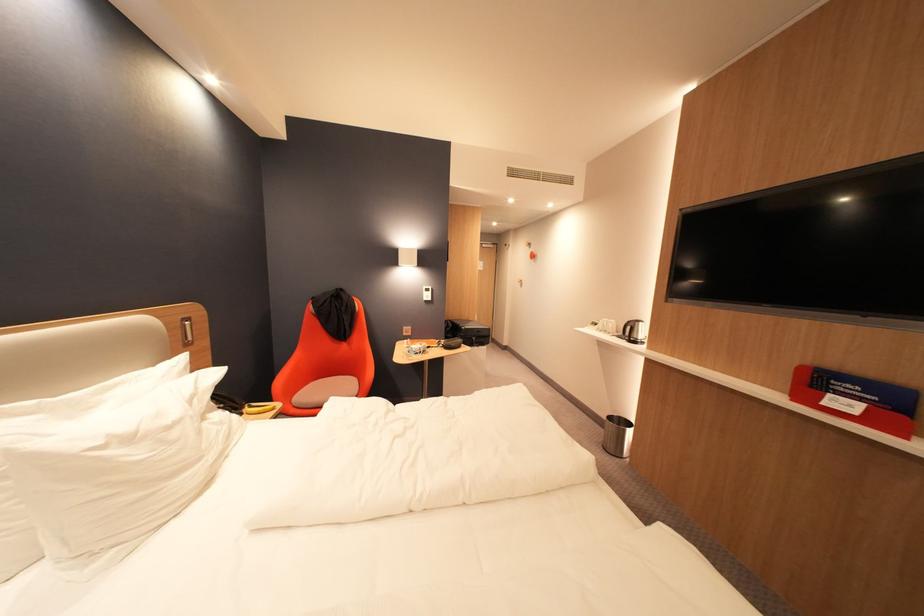
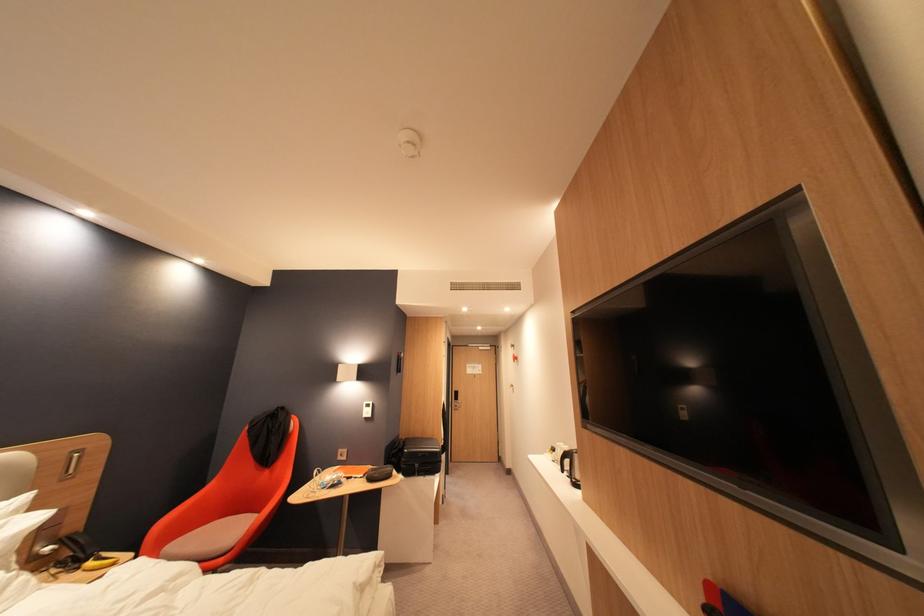
Find the pixel in the second image that matches point (593, 329) in the first image.

(553, 455)